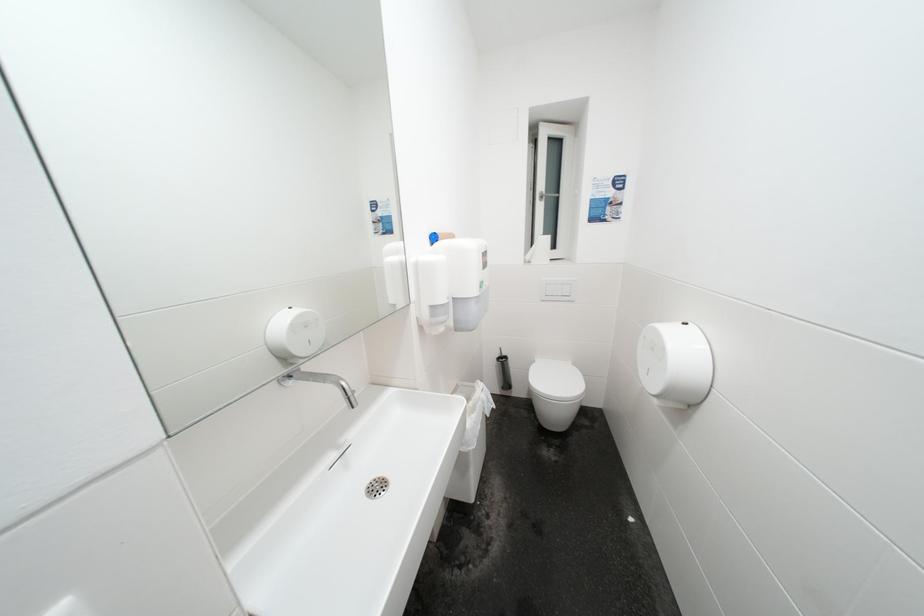
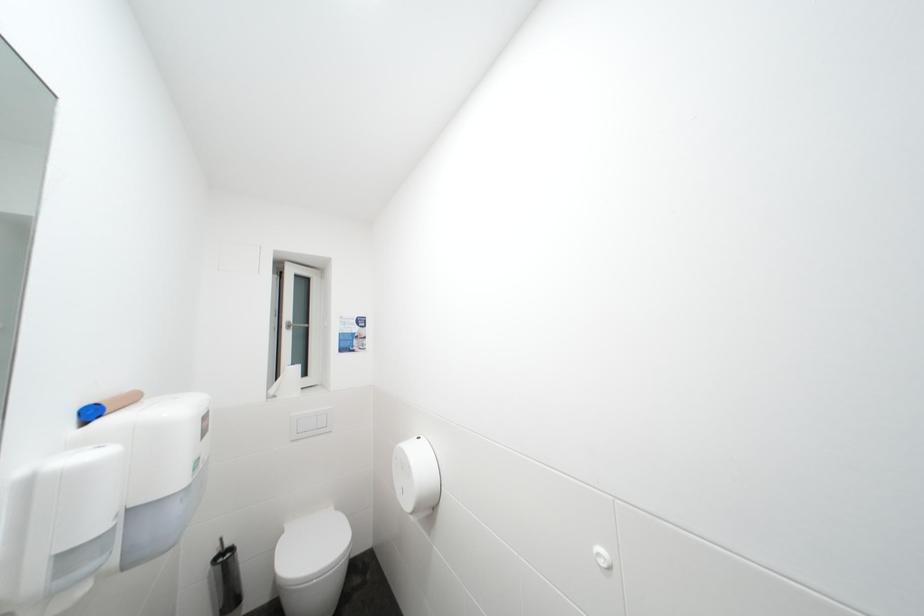
The first image is from the beginning of the video and the second image is from the end. How did the camera likely rotate when shooting the video?

The rotation direction of the camera is right-up.